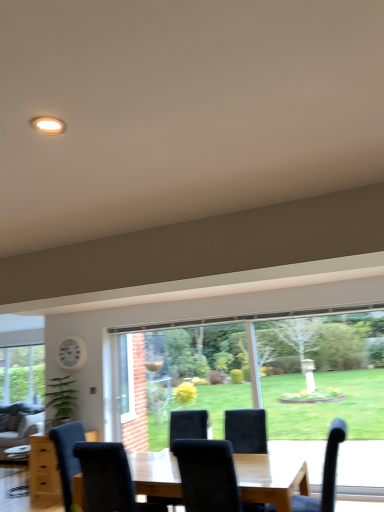
Question: From a real-world perspective, is white plastic clock at upper left above or below velvet black chair at center, the 2th chair positioned from the right?

Choices:
 (A) above
 (B) below

Answer: (A)

Question: Choose the correct answer: Is white plastic clock at upper left inside velvet black chair at center, the 2th chair positioned from the right, or outside it?

Choices:
 (A) inside
 (B) outside

Answer: (B)

Question: Which of these objects is positioned closest to the velvet grey couch at lower left?

Choices:
 (A) velvet black chair at lower right, acting as the 1th chair starting from the right
 (B) white plastic clock at upper left
 (C) velvet black chair at center, the 2th chair positioned from the right

Answer: (B)

Question: Which is nearer to the velvet black chair at lower right, acting as the 1th chair starting from the right?

Choices:
 (A) velvet black chair at center, the 2th chair positioned from the right
 (B) white plastic clock at upper left
 (C) velvet grey couch at lower left

Answer: (A)